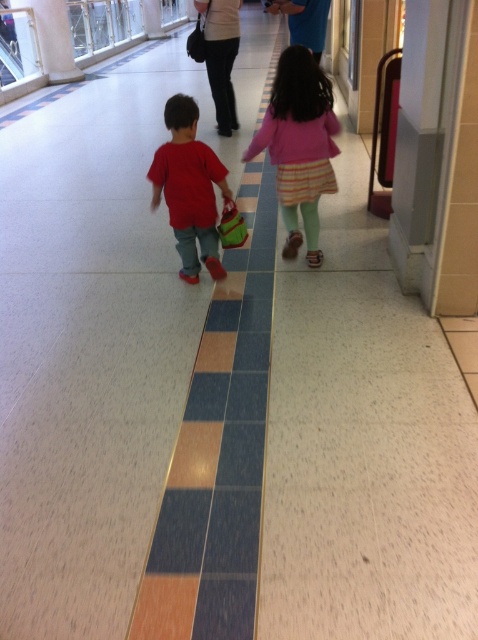
Who is taller, matte pink sweater at center or matte red shirt at center?

matte pink sweater at center

Which is in front, point (325, 116) or point (192, 195)?

Point (192, 195) is more forward.

Does point (286, 76) come closer to viewer compared to point (213, 196)?

Yes.

Find the location of a particular element. The height and width of the screenshot is (640, 478). matte pink sweater at center is located at coordinates (300, 145).